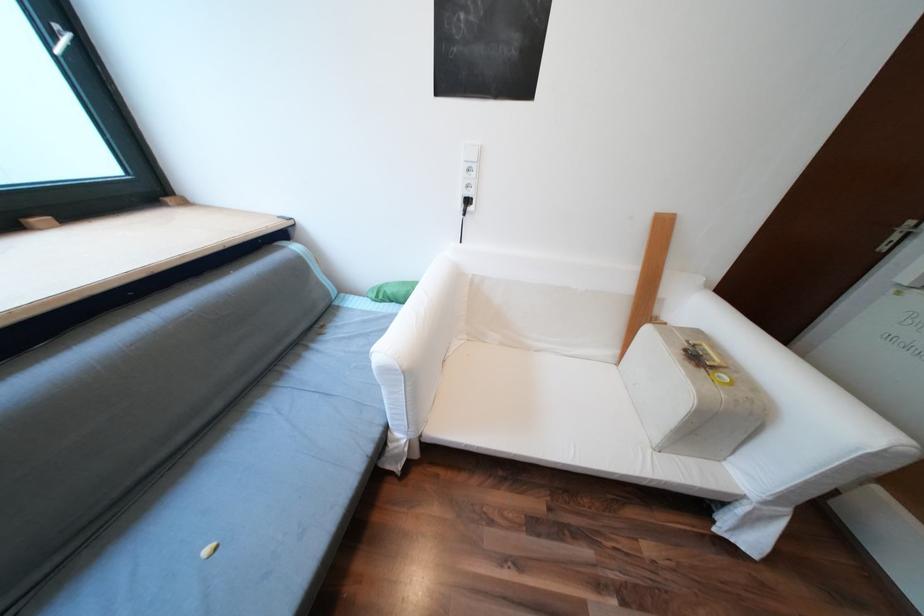
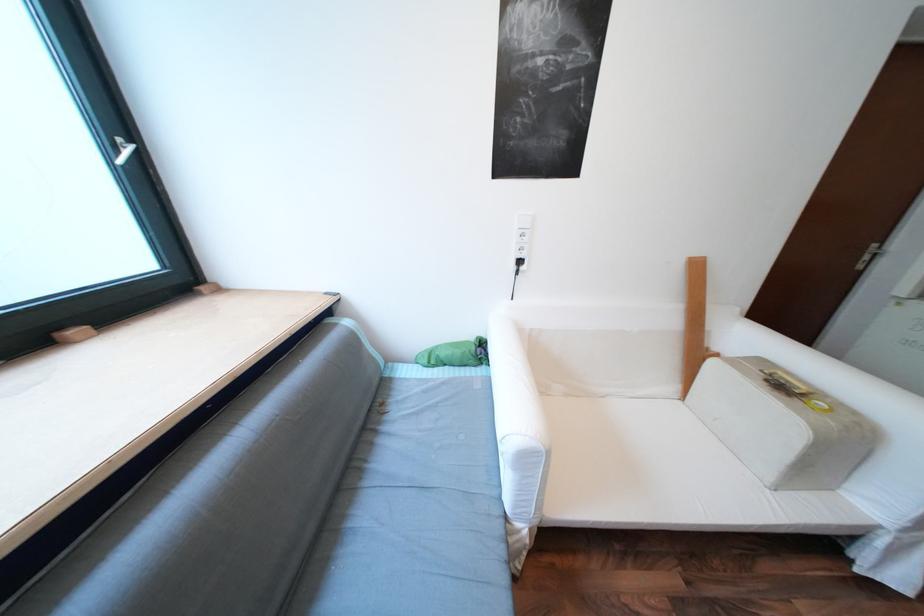
In the second image, find the point that corresponds to pixel 722 367 in the first image.

(811, 394)